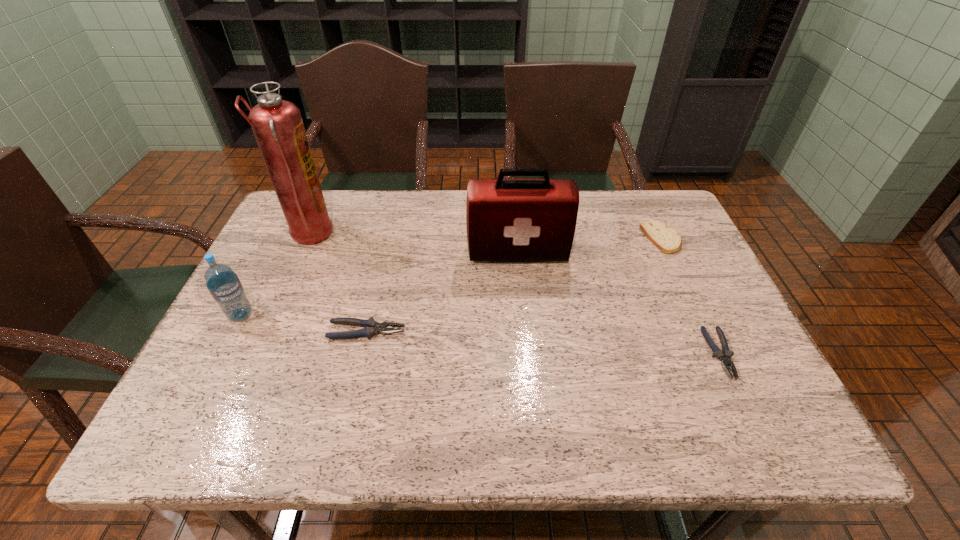
Identify the location of the left pliers. This screenshot has width=960, height=540. (372, 327).

Image resolution: width=960 pixels, height=540 pixels. I want to click on the third object from left to right, so click(x=372, y=327).

Locate an element on the screen. The image size is (960, 540). the shorter pliers is located at coordinates (725, 357).

The width and height of the screenshot is (960, 540). I want to click on the shortest object, so click(x=725, y=357).

This screenshot has height=540, width=960. What are the coordinates of `fire extinguisher` in the screenshot? It's located at (277, 124).

Where is `the fourth object from left to right`? The width and height of the screenshot is (960, 540). the fourth object from left to right is located at coordinates (507, 219).

You are a GUI agent. You are given a task and a screenshot of the screen. Output one action in this format:
    pyautogui.click(x=<x>, y=<y>)
    Task: Click on the first aid kit
    Image resolution: width=960 pixels, height=540 pixels.
    Given the screenshot: What is the action you would take?
    pyautogui.click(x=507, y=219)

Locate an element on the screen. This screenshot has width=960, height=540. water bottle is located at coordinates (223, 284).

Find the location of a particular element. The height and width of the screenshot is (540, 960). pita bread is located at coordinates (666, 239).

Find the location of a particular element. The width and height of the screenshot is (960, 540). vacant area situated at the gripping part of the taller pliers is located at coordinates (431, 331).